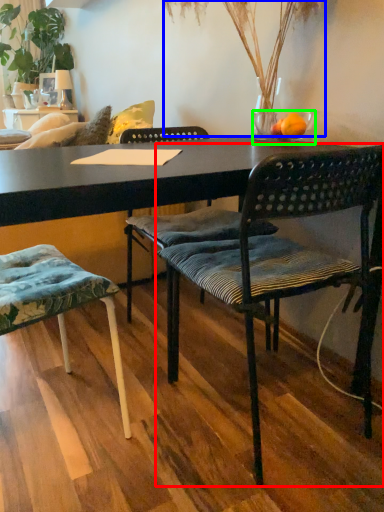
Question: Which object is positioned closest to chair (highlighted by a red box)? Select from plant (highlighted by a blue box) and bowl (highlighted by a green box).

Choices:
 (A) plant
 (B) bowl

Answer: (B)